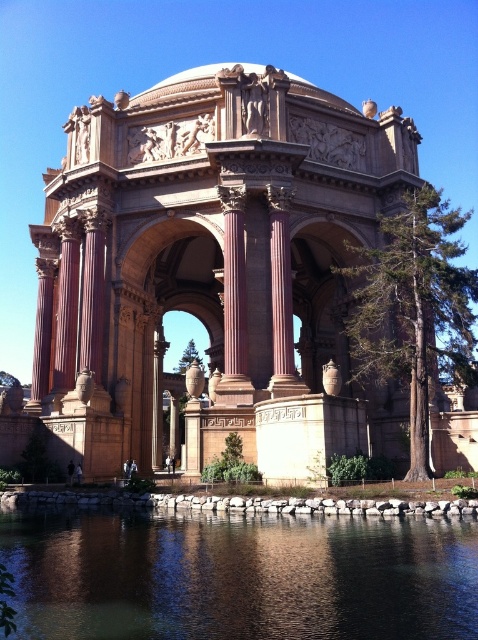
Question: Which point is farther to the camera?

Choices:
 (A) (322, 534)
 (B) (120, 248)

Answer: (B)

Question: Is beige stone palace at center closer to camera compared to transparent water at lower center?

Choices:
 (A) no
 (B) yes

Answer: (A)

Question: Is beige stone palace at center positioned in front of transparent water at lower center?

Choices:
 (A) yes
 (B) no

Answer: (B)

Question: Does beige stone palace at center have a larger size compared to transparent water at lower center?

Choices:
 (A) no
 (B) yes

Answer: (B)